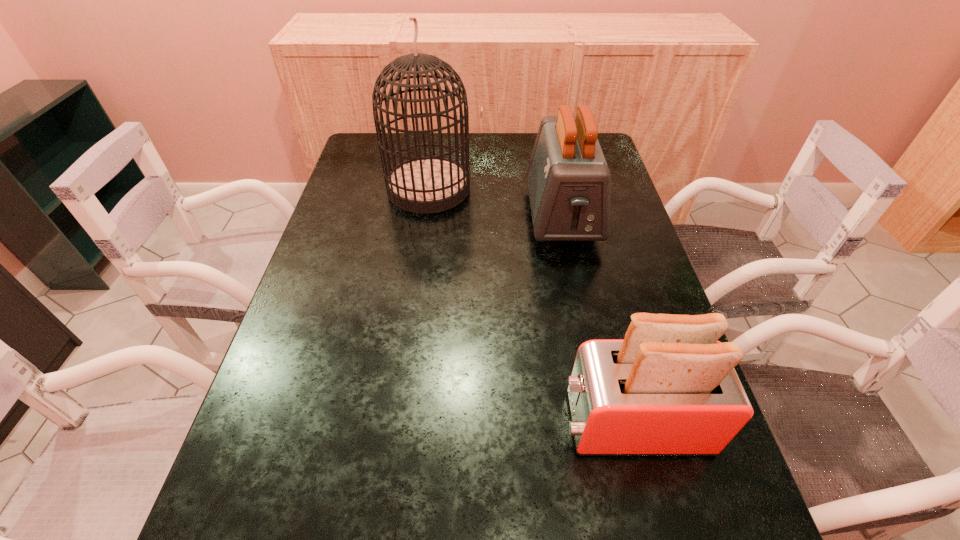
The height and width of the screenshot is (540, 960). What are the coordinates of `birdcage` in the screenshot? It's located at (430, 184).

Find the location of a particular element. The height and width of the screenshot is (540, 960). the leftmost object is located at coordinates [430, 184].

In order to click on the farther toaster in this screenshot , I will do `click(569, 183)`.

Find the location of a particular element. The height and width of the screenshot is (540, 960). the nearer toaster is located at coordinates (669, 388).

This screenshot has height=540, width=960. In order to click on vacant space located on the right of the leftmost object in this screenshot , I will do `click(578, 188)`.

Where is `vacant area situated on the front-facing side of the farther toaster`? This screenshot has width=960, height=540. vacant area situated on the front-facing side of the farther toaster is located at coordinates (577, 288).

You are a GUI agent. You are given a task and a screenshot of the screen. Output one action in this format:
    pyautogui.click(x=<x>, y=<y>)
    Task: Click on the free space located on the front-facing side of the nearer toaster
    This screenshot has width=960, height=540.
    Given the screenshot: What is the action you would take?
    pyautogui.click(x=437, y=422)

The width and height of the screenshot is (960, 540). I want to click on vacant space located 0.230m on the front-facing side of the nearer toaster, so click(x=437, y=422).

This screenshot has width=960, height=540. In order to click on vacant area located on the front-facing side of the nearer toaster in this screenshot , I will do tap(432, 422).

In order to click on object that is at the far edge in this screenshot , I will do `click(430, 184)`.